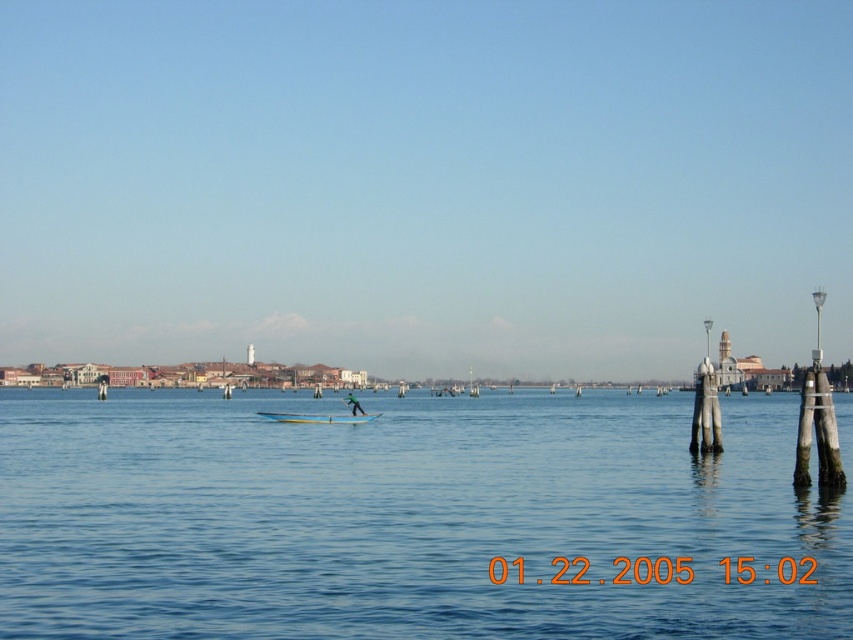
You are standing on the dock and see the blue water at center and the white glossy canoe at center. Which object is positioned to the right of the other?

The blue water at center is to the right of the white glossy canoe at center.

You are planning to take a photo of the blue water at center and the white glossy canoe at center. Which object will occupy more space in your photo?

The blue water at center has a larger size compared to the white glossy canoe at center, so it will occupy more space in the photo.